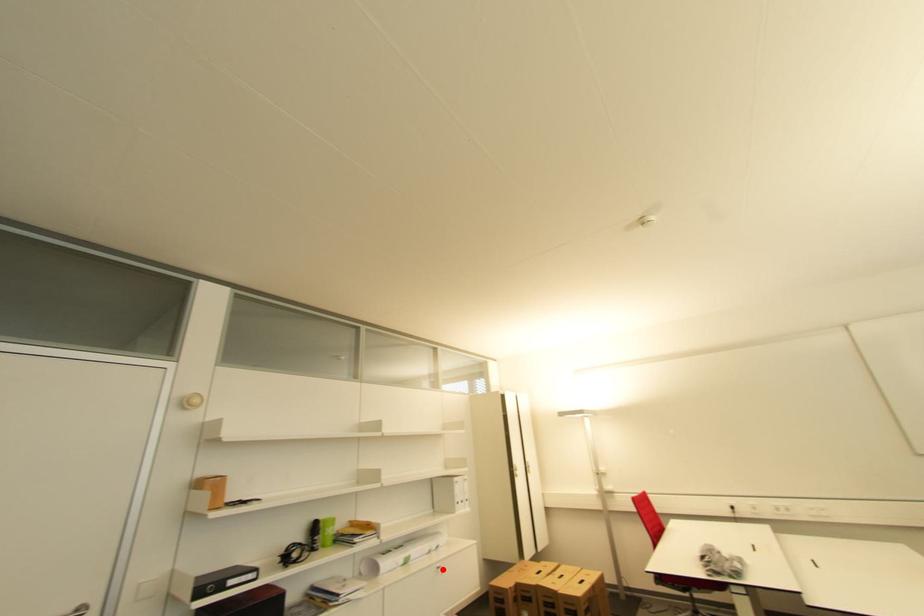
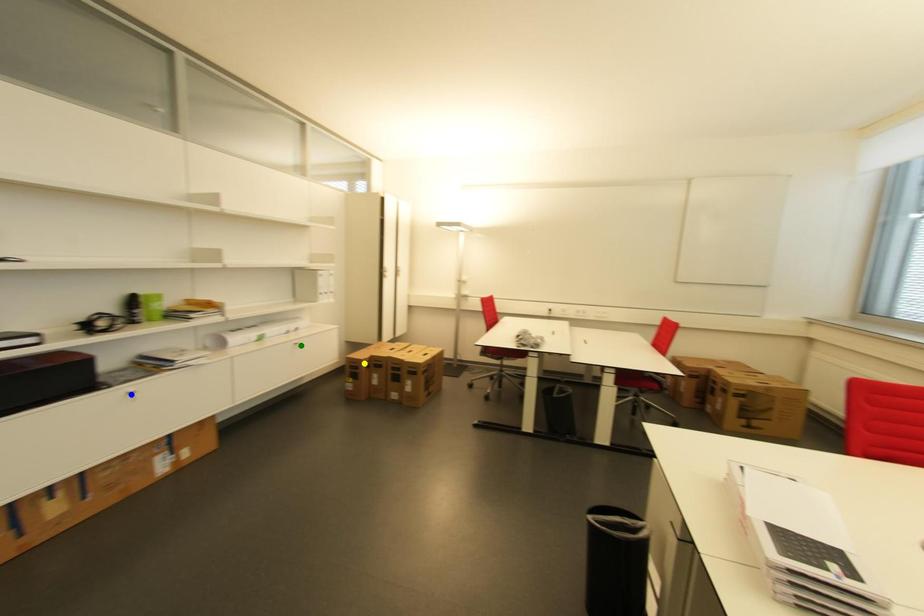
Question: I am providing you with two images of the same scene from different viewpoints. A red point is marked on the first image. You are given multiple points on the second image. Which mark in image 2 goes with the point in image 1?

Choices:
 (A) green point
 (B) blue point
 (C) yellow point

Answer: (A)